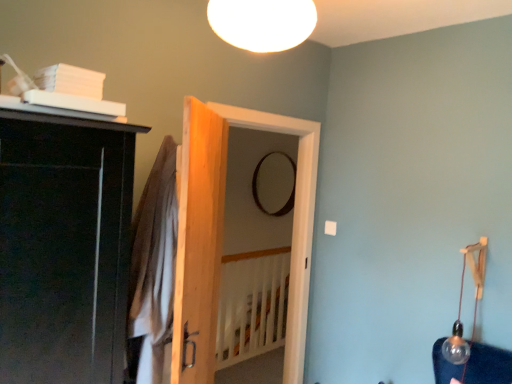
How much space does wooden door at center, which appears as the second door when viewed from the front, occupy horizontally?

wooden door at center, which appears as the second door when viewed from the front, is 13.85 centimeters wide.

Locate an element on the screen. Image resolution: width=512 pixels, height=384 pixels. white matte ceiling light at upper center, the first lamp viewed from the top is located at coordinates (262, 23).

This screenshot has height=384, width=512. I want to click on natural wood door at center, which is the 2th door in back-to-front order, so click(199, 242).

You are a GUI agent. You are given a task and a screenshot of the screen. Output one action in this format:
    pyautogui.click(x=<x>, y=<y>)
    Task: Click on the brown cotton robe at center
    The height and width of the screenshot is (384, 512).
    Given the screenshot: What is the action you would take?
    pyautogui.click(x=153, y=270)

What is the approximate width of brown cotton robe at center?

It is 12.88 inches.

Image resolution: width=512 pixels, height=384 pixels. In order to click on black matte mirror at center in this screenshot , I will do pyautogui.click(x=257, y=191).

Could wooden door at center, positioned as the first door in back-to-front order, be considered to be inside black matte mirror at center?

That's incorrect, wooden door at center, positioned as the first door in back-to-front order, is not inside black matte mirror at center.

In the image, is black matte mirror at center on the left side or the right side of wooden door at center, positioned as the first door in back-to-front order?

black matte mirror at center is positioned on wooden door at center, positioned as the first door in back-to-front order,'s right side.

Is the depth of black matte mirror at center greater than that of wooden door at center, positioned as the first door in back-to-front order?

That is True.

Is black matte mirror at center bigger or smaller than wooden door at center, which appears as the second door when viewed from the front?

Considering their sizes, black matte mirror at center takes up less space than wooden door at center, which appears as the second door when viewed from the front.

Is white wooden bed frame at center facing away from wooden door at center, which appears as the second door when viewed from the front?

That's not correct — white wooden bed frame at center is not looking away from wooden door at center, which appears as the second door when viewed from the front.

Is white wooden bed frame at center closer to the viewer compared to wooden door at center, positioned as the first door in back-to-front order?

No, it is behind wooden door at center, positioned as the first door in back-to-front order.

From a real-world perspective, which object stands above the other?

wooden door at center, which appears as the second door when viewed from the front, is physically above.

Can we say clear glass bulb at right, the 1th lamp in the bottom-to-top sequence, lies outside white matte ceiling light at upper center, the first lamp viewed from the top?

clear glass bulb at right, the 1th lamp in the bottom-to-top sequence, lies outside white matte ceiling light at upper center, the first lamp viewed from the top,'s area.

Which of these two, clear glass bulb at right, the 1th lamp in the bottom-to-top sequence, or white matte ceiling light at upper center, acting as the first lamp starting from the front, stands shorter?

white matte ceiling light at upper center, acting as the first lamp starting from the front, is shorter.

Considering the sizes of clear glass bulb at right, the 2th lamp from the top, and white matte ceiling light at upper center, marked as the second lamp in a right-to-left arrangement, in the image, is clear glass bulb at right, the 2th lamp from the top, wider or thinner than white matte ceiling light at upper center, marked as the second lamp in a right-to-left arrangement,?

clear glass bulb at right, the 2th lamp from the top, is thinner than white matte ceiling light at upper center, marked as the second lamp in a right-to-left arrangement.

Is clear glass bulb at right, the 1th lamp in the bottom-to-top sequence, next to white matte ceiling light at upper center, marked as the second lamp in a right-to-left arrangement, and touching it?

No, clear glass bulb at right, the 1th lamp in the bottom-to-top sequence, is not next to white matte ceiling light at upper center, marked as the second lamp in a right-to-left arrangement.

Does point (266, 214) lie in front of point (161, 337)?

No, it is behind (161, 337).

Would you consider black matte mirror at center to be distant from brown cotton robe at center?

Yes.

From the image's perspective, is black matte mirror at center under brown cotton robe at center?

No, from the image's perspective, black matte mirror at center is not beneath brown cotton robe at center.

Does black matte mirror at center have a larger size compared to brown cotton robe at center?

Indeed, black matte mirror at center has a larger size compared to brown cotton robe at center.

How many degrees apart are the facing directions of wooden door at center, which appears as the second door when viewed from the front, and white matte ceiling light at upper center, which is the second lamp from bottom to top?

There is a 91.5-degree angle between the facing directions of wooden door at center, which appears as the second door when viewed from the front, and white matte ceiling light at upper center, which is the second lamp from bottom to top.

Can you confirm if wooden door at center, positioned as the first door in back-to-front order, is taller than white matte ceiling light at upper center, the first lamp viewed from the top?

Yes, wooden door at center, positioned as the first door in back-to-front order, is taller than white matte ceiling light at upper center, the first lamp viewed from the top.

Is wooden door at center, positioned as the first door in back-to-front order, inside or outside of white matte ceiling light at upper center, the second lamp viewed from the back?

wooden door at center, positioned as the first door in back-to-front order, exists outside the volume of white matte ceiling light at upper center, the second lamp viewed from the back.

Looking at this image, from the image's perspective, is wooden door at center, positioned as the first door in back-to-front order, under white matte ceiling light at upper center, the first lamp viewed from the top?

Yes.

From the image's perspective, would you say natural wood door at center, which is the 2th door in back-to-front order, is shown under white matte ceiling light at upper center, the second lamp viewed from the back?

Yes, from the image's perspective, natural wood door at center, which is the 2th door in back-to-front order, is below white matte ceiling light at upper center, the second lamp viewed from the back.

Which object is thinner, natural wood door at center, which is the 2th door in back-to-front order, or white matte ceiling light at upper center, which ranks as the 1th lamp in left-to-right order?

natural wood door at center, which is the 2th door in back-to-front order, is thinner.

Is white matte ceiling light at upper center, marked as the second lamp in a right-to-left arrangement, a part of natural wood door at center, which is the 2th door in back-to-front order?

No, white matte ceiling light at upper center, marked as the second lamp in a right-to-left arrangement, is located outside of natural wood door at center, which is the 2th door in back-to-front order.

Is brown cotton robe at center facing away from wooden door at center, which appears as the second door when viewed from the front?

Yes.

How far apart are brown cotton robe at center and wooden door at center, which appears as the second door when viewed from the front?

brown cotton robe at center is 15.49 inches away from wooden door at center, which appears as the second door when viewed from the front.

From a real-world perspective, is brown cotton robe at center positioned above or below wooden door at center, positioned as the first door in back-to-front order?

In terms of real-world spatial position, brown cotton robe at center is above wooden door at center, positioned as the first door in back-to-front order.

Looking at this image, is there a large distance between brown cotton robe at center and wooden door at center, which appears as the second door when viewed from the front?

No, brown cotton robe at center is not far away from wooden door at center, which appears as the second door when viewed from the front.

Where is `the 1st door in front of the black matte mirror at center`? Image resolution: width=512 pixels, height=384 pixels. the 1st door in front of the black matte mirror at center is located at coordinates (222, 233).

The height and width of the screenshot is (384, 512). There is a white wooden bed frame at center. Identify the location of the 1st door above it (from the image's perspective). (222, 233).

Considering their positions, is brown cotton robe at center positioned further to natural wood door at center, placed as the 1th door when sorted from front to back, than black matte mirror at center?

black matte mirror at center.

From the image, which object appears to be nearer to white wooden bed frame at center, clear glass bulb at right, the second lamp viewed from the front, or brown cotton robe at center?

Among the two, clear glass bulb at right, the second lamp viewed from the front, is located nearer to white wooden bed frame at center.

Which object lies nearer to the anchor point white wooden bed frame at center, black matte mirror at center or wooden door at center, positioned as the first door in back-to-front order?

black matte mirror at center lies closer to white wooden bed frame at center than the other object.

Estimate the real-world distances between objects in this image. Which object is further from brown cotton robe at center, white wooden bed frame at center or black matte mirror at center?

Among the two, black matte mirror at center is located further to brown cotton robe at center.

From the image, which object appears to be farther from white matte ceiling light at upper center, the second lamp viewed from the back, white wooden bed frame at center or natural wood door at center, placed as the 1th door when sorted from front to back?

Based on the image, white wooden bed frame at center appears to be further to white matte ceiling light at upper center, the second lamp viewed from the back.

Which object lies nearer to the anchor point white matte ceiling light at upper center, the second lamp viewed from the back, clear glass bulb at right, which is the 2th lamp from left to right, or natural wood door at center, placed as the 1th door when sorted from front to back?

natural wood door at center, placed as the 1th door when sorted from front to back, is closer to white matte ceiling light at upper center, the second lamp viewed from the back.

When comparing their distances from black matte mirror at center, does natural wood door at center, which is the 2th door in back-to-front order, or clear glass bulb at right, the second lamp viewed from the front, seem further?

Based on the image, natural wood door at center, which is the 2th door in back-to-front order, appears to be further to black matte mirror at center.

Looking at this image, looking at the image, which one is located closer to brown cotton robe at center, clear glass bulb at right, arranged as the first lamp when viewed from the right, or white wooden bed frame at center?

Among the two, clear glass bulb at right, arranged as the first lamp when viewed from the right, is located nearer to brown cotton robe at center.

Find the location of a particular element. The height and width of the screenshot is (384, 512). bed frame between natural wood door at center, placed as the 1th door when sorted from front to back, and black matte mirror at center in the front-back direction is located at coordinates (252, 305).

At what (x,y) coordinates should I click in order to perform the action: click on lamp between white matte ceiling light at upper center, the second lamp viewed from the back, and white wooden bed frame at center in the front-back direction. Please return your answer as a coordinate pair (x, y). The width and height of the screenshot is (512, 384). Looking at the image, I should click on tap(461, 303).

Where is `lamp between natural wood door at center, which is the 2th door in back-to-front order, and white wooden bed frame at center in the front-back direction`? The image size is (512, 384). lamp between natural wood door at center, which is the 2th door in back-to-front order, and white wooden bed frame at center in the front-back direction is located at coordinates (461, 303).

What are the coordinates of `bed frame between clear glass bulb at right, which is the 2th lamp from left to right, and black matte mirror at center in the front-back direction` in the screenshot? It's located at (252, 305).